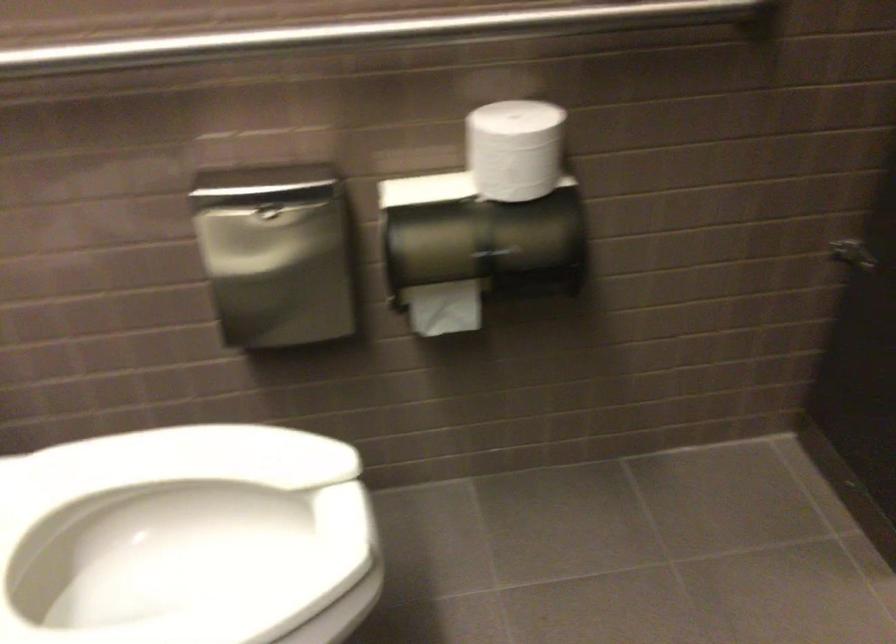
Locate an element on the screen. The image size is (896, 644). toilet paper dispenser is located at coordinates (474, 247).